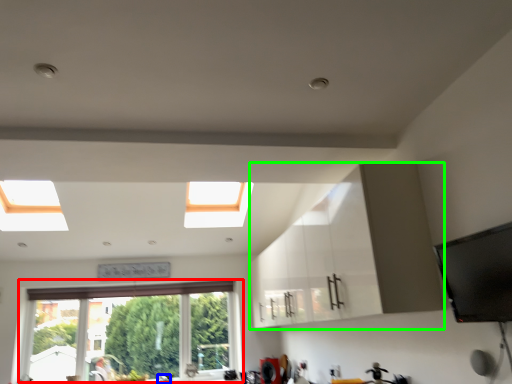
Question: Which object is the farthest from window (highlighted by a red box)? Choose among these: faucet (highlighted by a blue box) or cabinetry (highlighted by a green box).

Choices:
 (A) faucet
 (B) cabinetry

Answer: (B)